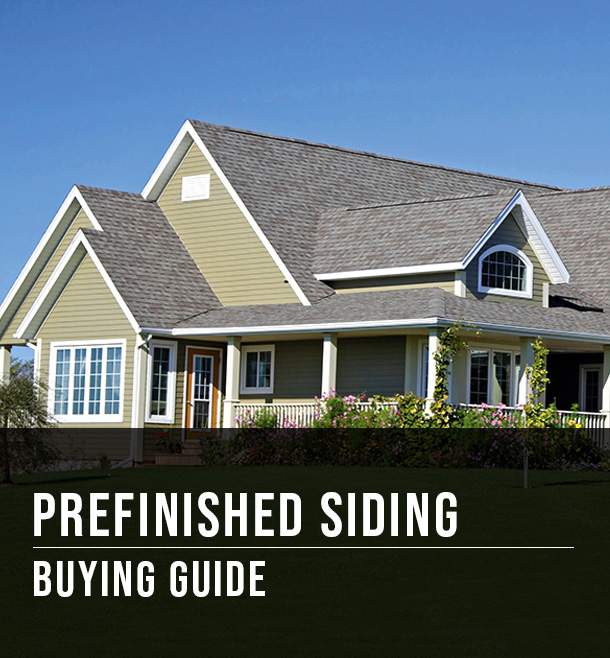
Where is `door`? The image size is (610, 658). door is located at coordinates pyautogui.click(x=198, y=386).